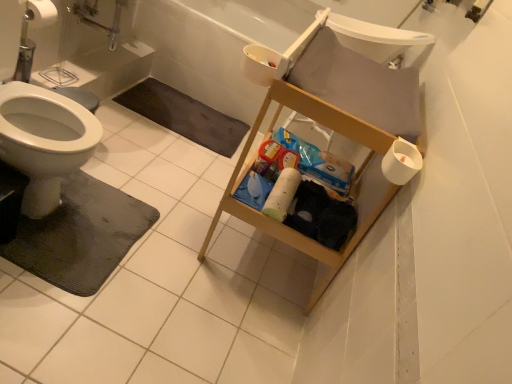
What is the approximate width of white matte toilet paper at right, marked as the 1th toilet paper in a right-to-left arrangement?

The width of white matte toilet paper at right, marked as the 1th toilet paper in a right-to-left arrangement, is 4.79 inches.

Find the location of a particular element. The height and width of the screenshot is (384, 512). black rubber bath mat at lower left, acting as the 2th bath mat starting from the bottom is located at coordinates (184, 116).

Which of these two, white matte toilet paper at center, which appears as the 1th toilet paper when viewed from the back, or black rubber bath mat at lower left, the first bath mat viewed from the back, stands taller?

white matte toilet paper at center, which appears as the 1th toilet paper when viewed from the back.

Can we say white matte toilet paper at center, the 2th toilet paper in the front-to-back sequence, lies outside black rubber bath mat at lower left, acting as the 2th bath mat starting from the front?

That's correct, white matte toilet paper at center, the 2th toilet paper in the front-to-back sequence, is outside of black rubber bath mat at lower left, acting as the 2th bath mat starting from the front.

Is white matte toilet paper at center, which appears as the first toilet paper when viewed from the left, not near black rubber bath mat at lower left, placed as the first bath mat when sorted from top to bottom?

Yes, white matte toilet paper at center, which appears as the first toilet paper when viewed from the left, and black rubber bath mat at lower left, placed as the first bath mat when sorted from top to bottom, are quite far apart.

How different are the orientations of white matte toilet paper at center, the 2th toilet paper in the front-to-back sequence, and black rubber bath mat at lower left, placed as the first bath mat when sorted from top to bottom, in degrees?

white matte toilet paper at center, the 2th toilet paper in the front-to-back sequence, and black rubber bath mat at lower left, placed as the first bath mat when sorted from top to bottom, are facing 91.9 degrees away from each other.

Looking at the image, does white matte toilet paper at right, placed as the second toilet paper when sorted from back to front, seem bigger or smaller compared to white matte toilet paper at center, which appears as the 1th toilet paper when viewed from the back?

Clearly, white matte toilet paper at right, placed as the second toilet paper when sorted from back to front, is smaller in size than white matte toilet paper at center, which appears as the 1th toilet paper when viewed from the back.

In terms of width, does white matte toilet paper at right, arranged as the second toilet paper when viewed from the left, look wider or thinner when compared to white matte toilet paper at center, placed as the 2th toilet paper when sorted from right to left?

Clearly, white matte toilet paper at right, arranged as the second toilet paper when viewed from the left, has more width compared to white matte toilet paper at center, placed as the 2th toilet paper when sorted from right to left.

From the image's perspective, who appears lower, white matte toilet paper at right, marked as the 1th toilet paper in a right-to-left arrangement, or white matte toilet paper at center, which appears as the 1th toilet paper when viewed from the back?

white matte toilet paper at center, which appears as the 1th toilet paper when viewed from the back, from the image's perspective.

Is black rubber bath mat at lower left, which ranks as the first bath mat in bottom-to-top order, at the left side of white matte toilet paper at center, placed as the 2th toilet paper when sorted from right to left?

Yes.

Considering the relative sizes of black rubber bath mat at lower left, which is counted as the second bath mat, starting from the top, and white matte toilet paper at center, which appears as the first toilet paper when viewed from the left, in the image provided, is black rubber bath mat at lower left, which is counted as the second bath mat, starting from the top, wider than white matte toilet paper at center, which appears as the first toilet paper when viewed from the left,?

Yes.

From the image's perspective, is black rubber bath mat at lower left, which is counted as the second bath mat, starting from the top, located above white matte toilet paper at center, which appears as the first toilet paper when viewed from the left?

No, from the image's perspective, black rubber bath mat at lower left, which is counted as the second bath mat, starting from the top, is not over white matte toilet paper at center, which appears as the first toilet paper when viewed from the left.

Considering the sizes of white plastic sink at upper right and black rubber bath mat at lower left, which ranks as the first bath mat in bottom-to-top order, in the image, is white plastic sink at upper right wider or thinner than black rubber bath mat at lower left, which ranks as the first bath mat in bottom-to-top order,?

In the image, white plastic sink at upper right appears to be more narrow than black rubber bath mat at lower left, which ranks as the first bath mat in bottom-to-top order.

Considering the sizes of white plastic sink at upper right and black rubber bath mat at lower left, which is counted as the second bath mat, starting from the top, in the image, is white plastic sink at upper right taller or shorter than black rubber bath mat at lower left, which is counted as the second bath mat, starting from the top,?

Considering their sizes, white plastic sink at upper right has more height than black rubber bath mat at lower left, which is counted as the second bath mat, starting from the top.

Considering the relative positions of white plastic sink at upper right and black rubber bath mat at lower left, which ranks as the first bath mat in bottom-to-top order, in the image provided, is white plastic sink at upper right to the left or to the right of black rubber bath mat at lower left, which ranks as the first bath mat in bottom-to-top order,?

white plastic sink at upper right is positioned on black rubber bath mat at lower left, which ranks as the first bath mat in bottom-to-top order,'s right side.

The width and height of the screenshot is (512, 384). In order to click on sink lying above the black rubber bath mat at lower left, which ranks as the 1th bath mat in front-to-back order (from the image's perspective) in this screenshot , I will do `click(380, 41)`.

Is white plastic bathtub at upper center positioned with its back to white plastic sink at upper right?

That's not correct — white plastic bathtub at upper center is not looking away from white plastic sink at upper right.

Identify the location of sink that appears above the white plastic bathtub at upper center (from the image's perspective). Image resolution: width=512 pixels, height=384 pixels. (380, 41).

Are white plastic bathtub at upper center and white plastic sink at upper right located far from each other?

No, white plastic bathtub at upper center is not far from white plastic sink at upper right.

Looking at their sizes, would you say white plastic bathtub at upper center is wider or thinner than white plastic sink at upper right?

white plastic bathtub at upper center is wider than white plastic sink at upper right.

Is white matte toilet paper at center, which appears as the 1th toilet paper when viewed from the back, not close to white plastic sink at upper right?

No, white matte toilet paper at center, which appears as the 1th toilet paper when viewed from the back, is in close proximity to white plastic sink at upper right.

Considering the sizes of objects white matte toilet paper at center, which appears as the 1th toilet paper when viewed from the back, and white plastic sink at upper right in the image provided, who is thinner, white matte toilet paper at center, which appears as the 1th toilet paper when viewed from the back, or white plastic sink at upper right?

Thinner between the two is white matte toilet paper at center, which appears as the 1th toilet paper when viewed from the back.

From a real-world perspective, who is located higher, white matte toilet paper at center, which appears as the 1th toilet paper when viewed from the back, or white plastic sink at upper right?

white plastic sink at upper right.

Which object is more forward, white matte toilet paper at center, placed as the 2th toilet paper when sorted from right to left, or white plastic sink at upper right?

white matte toilet paper at center, placed as the 2th toilet paper when sorted from right to left, is closer to the camera.

Is white matte toilet paper at right, which is counted as the first toilet paper, starting from the front, not inside black rubber bath mat at lower left, the first bath mat viewed from the back?

white matte toilet paper at right, which is counted as the first toilet paper, starting from the front, lies outside black rubber bath mat at lower left, the first bath mat viewed from the back,'s area.

Which object is closer to the camera taking this photo, white matte toilet paper at right, which is counted as the first toilet paper, starting from the front, or black rubber bath mat at lower left, acting as the 2th bath mat starting from the bottom?

white matte toilet paper at right, which is counted as the first toilet paper, starting from the front, is in front.

From the image's perspective, does white matte toilet paper at right, marked as the 1th toilet paper in a right-to-left arrangement, appear higher than black rubber bath mat at lower left, acting as the 2th bath mat starting from the front?

No, from the image's perspective, white matte toilet paper at right, marked as the 1th toilet paper in a right-to-left arrangement, is not over black rubber bath mat at lower left, acting as the 2th bath mat starting from the front.

From their relative heights in the image, would you say white matte toilet paper at right, arranged as the second toilet paper when viewed from the left, is taller or shorter than black rubber bath mat at lower left, acting as the 2th bath mat starting from the front?

Clearly, white matte toilet paper at right, arranged as the second toilet paper when viewed from the left, is taller compared to black rubber bath mat at lower left, acting as the 2th bath mat starting from the front.

At what (x,y) coordinates should I click in order to perform the action: click on the 1st toilet paper directly above the black rubber bath mat at lower left, acting as the 2th bath mat starting from the front (from a real-world perspective). Please return your answer as a coordinate pair (x, y). This screenshot has height=384, width=512. Looking at the image, I should click on [282, 194].

Image resolution: width=512 pixels, height=384 pixels. I want to click on toilet paper that appears in front of the white matte toilet paper at center, the 2th toilet paper in the front-to-back sequence, so click(x=401, y=162).

Considering their positions, is white matte toilet paper at right, arranged as the second toilet paper when viewed from the left, positioned further to black rubber bath mat at lower left, acting as the 2th bath mat starting from the front, than white plastic bathtub at upper center?

white matte toilet paper at right, arranged as the second toilet paper when viewed from the left, lies further to black rubber bath mat at lower left, acting as the 2th bath mat starting from the front, than the other object.

Considering their positions, is white plastic sink at upper right positioned closer to white matte toilet paper at right, which is counted as the first toilet paper, starting from the front, than black rubber bath mat at lower left, placed as the first bath mat when sorted from top to bottom?

white plastic sink at upper right is positioned closer to the anchor white matte toilet paper at right, which is counted as the first toilet paper, starting from the front.

Estimate the real-world distances between objects in this image. Which object is further from white matte toilet paper at center, which appears as the 1th toilet paper when viewed from the back, white plastic bathtub at upper center or black rubber bath mat at lower left, the first bath mat viewed from the back?

The object further to white matte toilet paper at center, which appears as the 1th toilet paper when viewed from the back, is white plastic bathtub at upper center.

Looking at the image, which one is located closer to black rubber bath mat at lower left, which ranks as the 1th bath mat in front-to-back order, black rubber bath mat at lower left, acting as the 2th bath mat starting from the front, or white matte toilet paper at right, arranged as the second toilet paper when viewed from the left?

Based on the image, black rubber bath mat at lower left, acting as the 2th bath mat starting from the front, appears to be nearer to black rubber bath mat at lower left, which ranks as the 1th bath mat in front-to-back order.

Estimate the real-world distances between objects in this image. Which object is closer to white matte toilet paper at center, the 2th toilet paper in the front-to-back sequence, white plastic sink at upper right or black rubber bath mat at lower left, which ranks as the first bath mat in bottom-to-top order?

Based on the image, black rubber bath mat at lower left, which ranks as the first bath mat in bottom-to-top order, appears to be nearer to white matte toilet paper at center, the 2th toilet paper in the front-to-back sequence.

Considering their positions, is white plastic sink at upper right positioned further to white matte toilet paper at right, which is counted as the first toilet paper, starting from the front, than black rubber bath mat at lower left, which ranks as the second bath mat in back-to-front order?

black rubber bath mat at lower left, which ranks as the second bath mat in back-to-front order.

When comparing their distances from white matte toilet paper at right, marked as the 1th toilet paper in a right-to-left arrangement, does white plastic sink at upper right or white plastic bathtub at upper center seem further?

white plastic bathtub at upper center lies further to white matte toilet paper at right, marked as the 1th toilet paper in a right-to-left arrangement, than the other object.

From the image, which object appears to be nearer to white plastic bathtub at upper center, black rubber bath mat at lower left, acting as the 2th bath mat starting from the bottom, or black rubber bath mat at lower left, which ranks as the first bath mat in bottom-to-top order?

The object closer to white plastic bathtub at upper center is black rubber bath mat at lower left, acting as the 2th bath mat starting from the bottom.

Locate an element on the screen. The width and height of the screenshot is (512, 384). toilet paper situated between black rubber bath mat at lower left, which is counted as the second bath mat, starting from the top, and white matte toilet paper at right, marked as the 1th toilet paper in a right-to-left arrangement, from left to right is located at coordinates (282, 194).

Find the location of `bath mat located between black rubber bath mat at lower left, which ranks as the first bath mat in bottom-to-top order, and white plastic bathtub at upper center in the depth direction`. bath mat located between black rubber bath mat at lower left, which ranks as the first bath mat in bottom-to-top order, and white plastic bathtub at upper center in the depth direction is located at coordinates (184, 116).

You are a GUI agent. You are given a task and a screenshot of the screen. Output one action in this format:
    pyautogui.click(x=<x>, y=<y>)
    Task: Click on the toilet paper between white matte toilet paper at right, marked as the 1th toilet paper in a right-to-left arrangement, and black rubber bath mat at lower left, the first bath mat viewed from the back, along the z-axis
    
    Given the screenshot: What is the action you would take?
    pyautogui.click(x=282, y=194)

Locate an element on the screen. The height and width of the screenshot is (384, 512). toilet paper between black rubber bath mat at lower left, which ranks as the first bath mat in bottom-to-top order, and black rubber bath mat at lower left, the first bath mat viewed from the back, in the front-back direction is located at coordinates (282, 194).